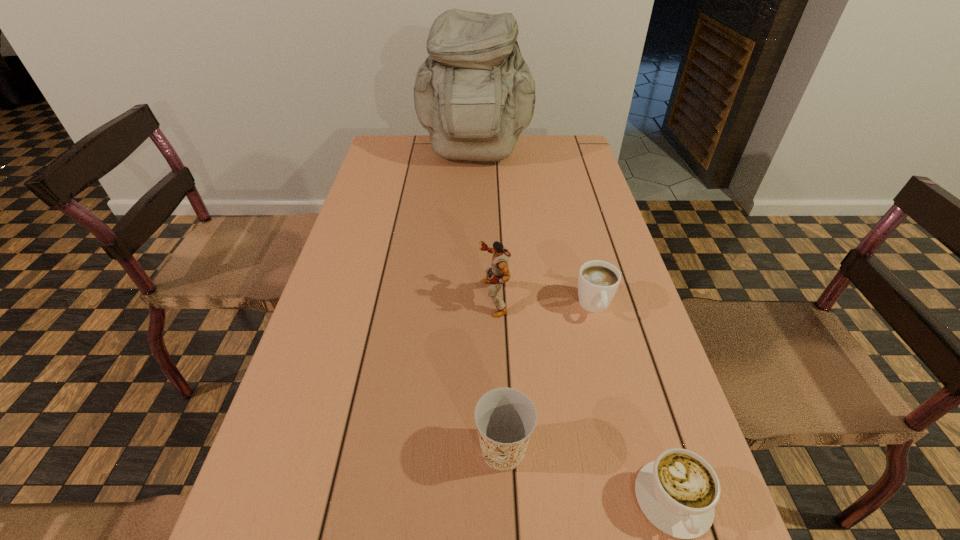
Find the location of a particular element. This screenshot has width=960, height=540. vacant point located between the farthest object and the third tallest object is located at coordinates (489, 303).

This screenshot has height=540, width=960. In order to click on vacant area that lies between the fourth shortest object and the Dixie cup in this screenshot , I will do `click(498, 374)`.

Where is `unoccupied position between the tallest object and the taller cappuccino`? The image size is (960, 540). unoccupied position between the tallest object and the taller cappuccino is located at coordinates (535, 232).

Locate an element on the screen. The width and height of the screenshot is (960, 540). object that is the closest to the Dixie cup is located at coordinates (677, 492).

Identify the location of the second closest object relative to the farthest object. The height and width of the screenshot is (540, 960). (598, 281).

At what (x,y) coordinates should I click in order to perform the action: click on vacant space that satisfies the following two spatial constraints: 1. on the front-facing side of the second tallest object; 2. on the back side of the third tallest object. Please return your answer as a coordinate pair (x, y). The image size is (960, 540). Looking at the image, I should click on (498, 450).